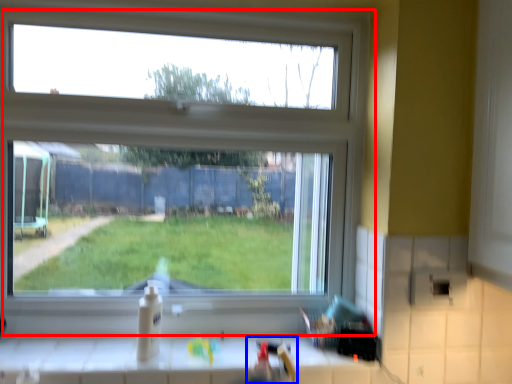
Question: Which object appears closest to the camera in this image, window (highlighted by a red box) or sink (highlighted by a blue box)?

Choices:
 (A) window
 (B) sink

Answer: (B)